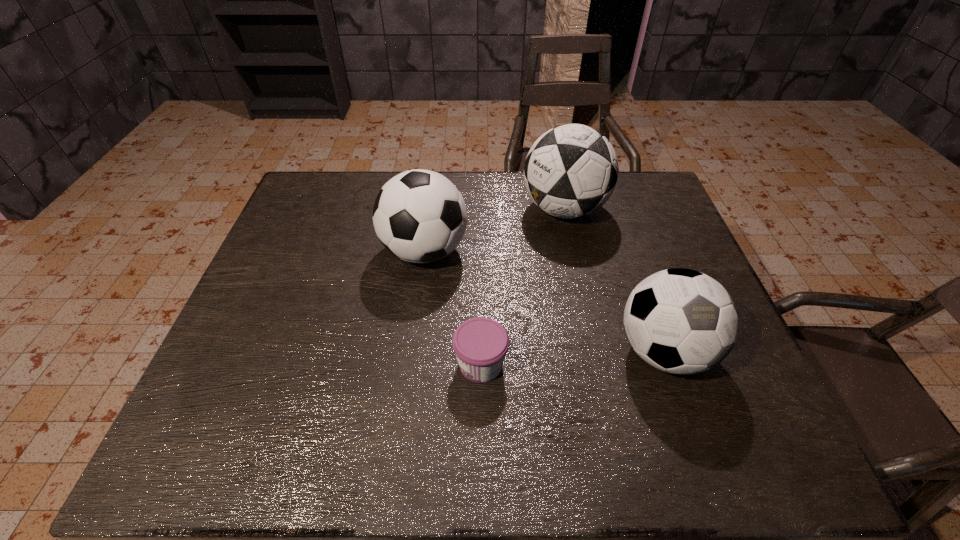
Where is `vacant space at the far edge of the desktop`? vacant space at the far edge of the desktop is located at coordinates (361, 187).

This screenshot has width=960, height=540. I want to click on vacant area at the near edge of the desktop, so click(656, 458).

Find the location of a particular element. vacant region at the left edge of the desktop is located at coordinates click(318, 264).

This screenshot has height=540, width=960. Find the location of `blank area at the right edge`. blank area at the right edge is located at coordinates (765, 421).

This screenshot has height=540, width=960. I want to click on vacant area at the far left corner, so click(302, 217).

The image size is (960, 540). In the image, there is a desktop. Find the location of `vacant space at the near left corner`. vacant space at the near left corner is located at coordinates (177, 460).

In the image, there is a desktop. Where is `vacant space at the far right corner`? vacant space at the far right corner is located at coordinates (623, 180).

The height and width of the screenshot is (540, 960). I want to click on vacant region between the nearest soccer ball and the leftmost soccer ball, so click(544, 301).

Where is `vacant region between the nearest soccer ball and the shortest object`? The width and height of the screenshot is (960, 540). vacant region between the nearest soccer ball and the shortest object is located at coordinates (572, 357).

Image resolution: width=960 pixels, height=540 pixels. Identify the location of free spot between the nearest soccer ball and the leftmost soccer ball. (544, 301).